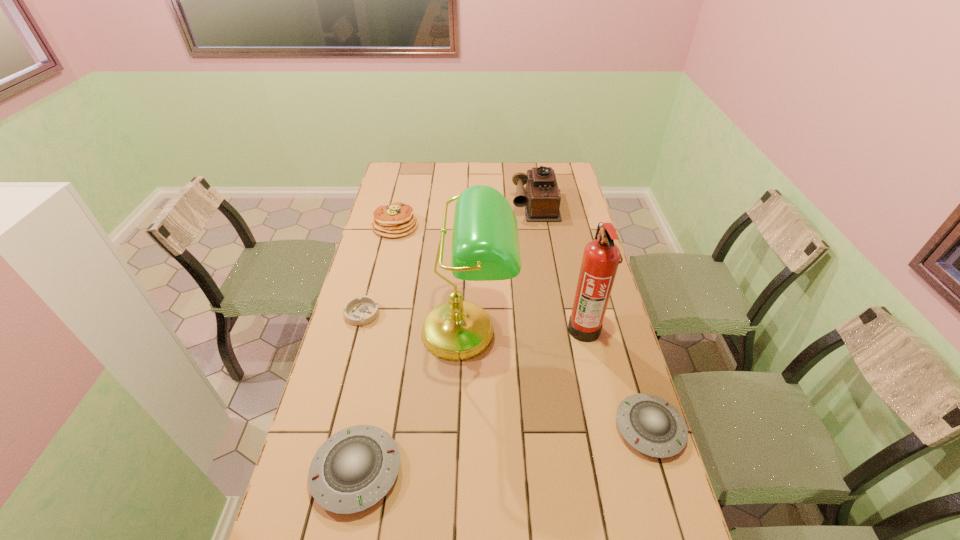
Image resolution: width=960 pixels, height=540 pixels. Identify the location of saucer that is at the left edge. (360, 463).

What are the coordinates of `pancake present at the left edge` in the screenshot? It's located at (394, 220).

The width and height of the screenshot is (960, 540). In order to click on ashtray present at the left edge in this screenshot , I will do `click(358, 311)`.

What are the coordinates of `saucer located in the right edge section of the desktop` in the screenshot? It's located at (653, 426).

You are a GUI agent. You are given a task and a screenshot of the screen. Output one action in this format:
    pyautogui.click(x=<x>, y=<y>)
    Task: Click on the phonograph_record present at the right edge
    The height and width of the screenshot is (540, 960).
    Given the screenshot: What is the action you would take?
    pyautogui.click(x=541, y=198)

Locate an element on the screen. The height and width of the screenshot is (540, 960). fire extinguisher that is at the right edge is located at coordinates (601, 257).

The height and width of the screenshot is (540, 960). Find the location of `object that is at the near left corner`. object that is at the near left corner is located at coordinates (360, 463).

At what (x,y) coordinates should I click in order to perform the action: click on object that is at the far right corner. Please return your answer as a coordinate pair (x, y). This screenshot has height=540, width=960. Looking at the image, I should click on (541, 198).

Find the location of a particular element. vacant space at the far edge is located at coordinates (528, 163).

Where is `vacant space at the near edge`? The height and width of the screenshot is (540, 960). vacant space at the near edge is located at coordinates (564, 507).